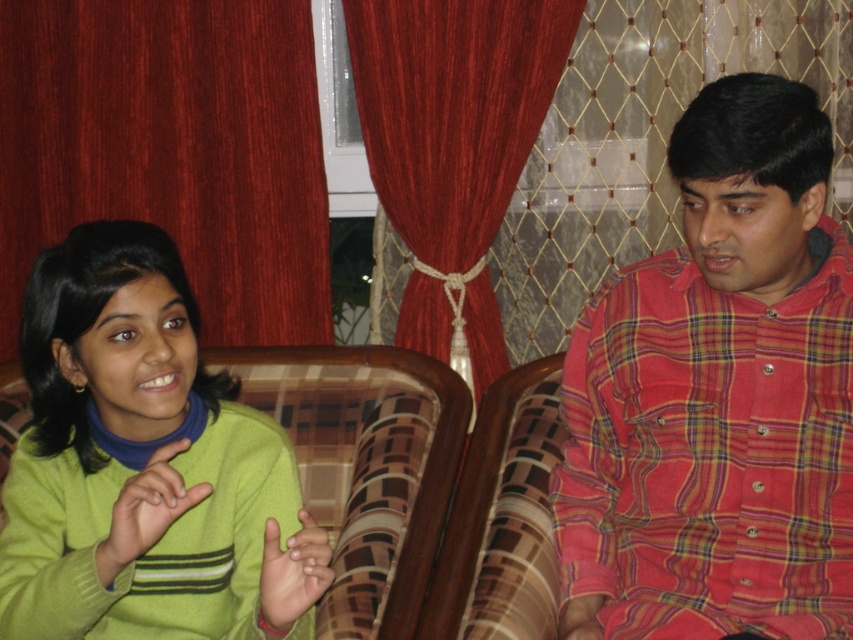
Can you confirm if maroon fabric curtain at upper left is positioned to the right of green matte hand at lower left?

In fact, maroon fabric curtain at upper left is to the left of green matte hand at lower left.

Who is more distant from viewer, (x=9, y=141) or (x=112, y=541)?

The point (x=9, y=141) is behind.

Is point (0, 195) positioned behind point (135, 502)?

Yes, it is.

Identify the location of maroon fabric curtain at upper left. (171, 150).

Is velvet-like red curtain at center smaller than smooth skin hand at center?

Incorrect, velvet-like red curtain at center is not smaller in size than smooth skin hand at center.

Is velvet-like red curtain at center taller than smooth skin hand at center?

Yes, velvet-like red curtain at center is taller than smooth skin hand at center.

Who is more distant from viewer, (405,92) or (274,600)?

The point (405,92) is more distant.

Identify the location of velvet-like red curtain at center. (453, 148).

Is red plaid shirt at right below green matte hand at lower left?

Actually, red plaid shirt at right is above green matte hand at lower left.

Between red plaid shirt at right and green matte hand at lower left, which one has less height?

With less height is green matte hand at lower left.

Is point (817, 232) positioned in front of point (144, 545)?

That is False.

Image resolution: width=853 pixels, height=640 pixels. I want to click on red plaid shirt at right, so click(x=718, y=396).